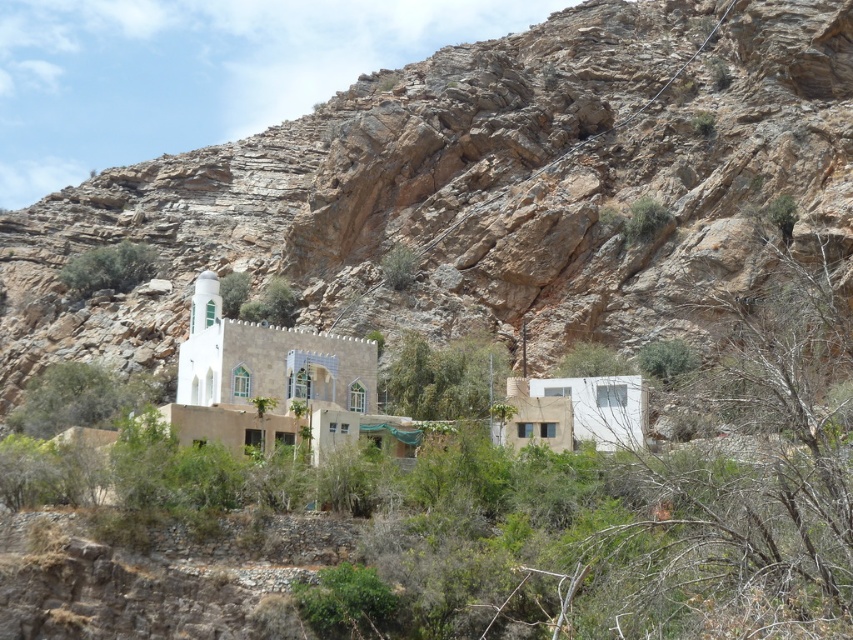
You are a hiker standing at the base of the brown rocky mountain at center and want to reach the green leafy bush at lower left. Which direction should you move to get closer to the bush?

The brown rocky mountain at center is in front of the green leafy bush at lower left, so to reach the bush, you should move towards the mountain first and then navigate around it to the left side.